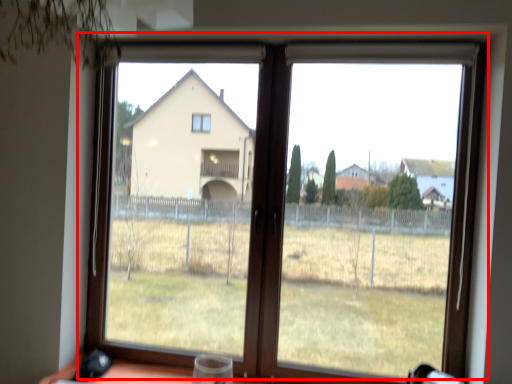
Question: From the image's perspective, what is the correct spatial relationship of window (annotated by the red box) in relation to wine glass?

Choices:
 (A) above
 (B) below

Answer: (A)